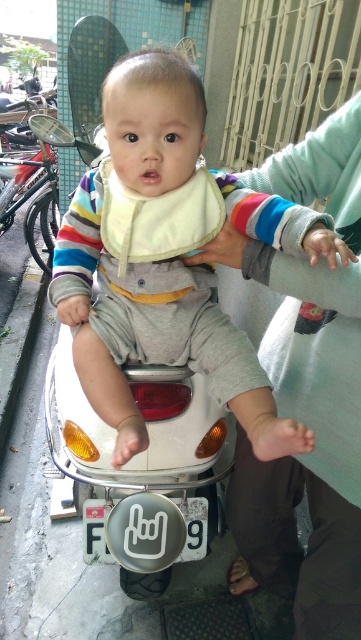
You are a photographer trying to capture the baby and the scooter in a single shot. The matte yellow bib at center and the light green fabric at upper center are both in your frame. Which object should you focus on first to ensure both are in focus?

The matte yellow bib at center is closer to the viewer than the light green fabric at upper center, so focus on the matte yellow bib at center first to ensure both are in focus.

You are a delivery person who needs to attach a small package to the scooter. The package is 10 inches long. You have two options to place it either on the matte yellow bib at center or the light green fabric at upper center. Considering the distance between them, which location would allow the package to fit without overlapping the other object?

The package is 10 inches long, and the distance between the matte yellow bib at center and the light green fabric at upper center is 9.03 inches. Since the package is longer than the space between them, placing it on either location would cause it to overlap the other object. Therefore, neither location is suitable for placing the package without overlapping.

You are a photographer trying to capture the baby and the scooter in the image. You notice the matte yellow bib at center and the light green fabric at upper center. Which object is located to the left of the other?

The matte yellow bib at center is positioned on the left side of light green fabric at upper center.